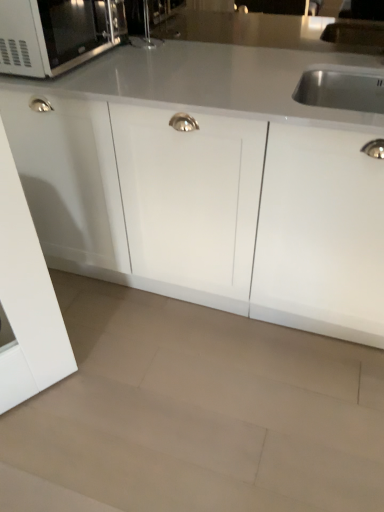
This screenshot has height=512, width=384. What are the coordinates of `vacant space to the right of matte black microwave at upper left` in the screenshot? It's located at (157, 68).